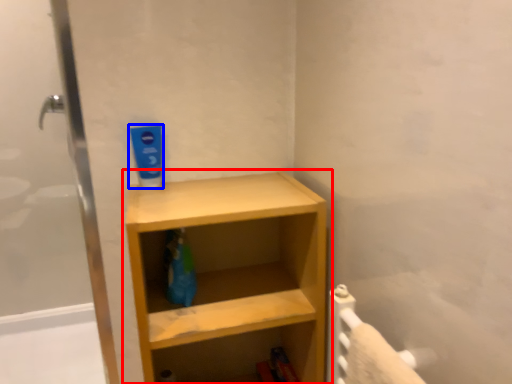
Question: Which object is closer to the camera taking this photo, shelf (highlighted by a red box) or toothpaste (highlighted by a blue box)?

Choices:
 (A) shelf
 (B) toothpaste

Answer: (A)